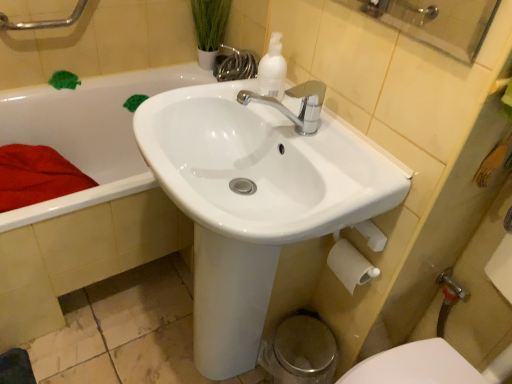
Image resolution: width=512 pixels, height=384 pixels. I want to click on white glossy bathtub at upper left, so click(x=88, y=134).

What do you see at coordinates (254, 199) in the screenshot? This screenshot has width=512, height=384. I see `white glossy sink at center` at bounding box center [254, 199].

Locate an element on the screen. Image resolution: width=512 pixels, height=384 pixels. white matte pump bottle at upper center is located at coordinates (272, 70).

The image size is (512, 384). What do you see at coordinates (451, 288) in the screenshot? I see `metallic silver faucet at lower right` at bounding box center [451, 288].

Describe the element at coordinates (210, 22) in the screenshot. The image size is (512, 384). I see `green leafy plant at upper center` at that location.

Find the location of a particular element. green leafy plant at upper center is located at coordinates (210, 22).

Image resolution: width=512 pixels, height=384 pixels. I want to click on white glossy bathtub at upper left, so click(88, 134).

Is metallic silver faucet at lower right to the left or to the right of brushed metal grab bar at upper left in the image?

From the image, it's evident that metallic silver faucet at lower right is to the right of brushed metal grab bar at upper left.

From the picture: Is metallic silver faucet at lower right wider than brushed metal grab bar at upper left?

No, metallic silver faucet at lower right is not wider than brushed metal grab bar at upper left.

From a real-world perspective, does metallic silver faucet at lower right stand above brushed metal grab bar at upper left?

No, from a real-world perspective, metallic silver faucet at lower right is not over brushed metal grab bar at upper left

Is metallic silver faucet at lower right far from brushed metal grab bar at upper left?

Yes, metallic silver faucet at lower right and brushed metal grab bar at upper left are quite far apart.

Which is in front, point (312, 97) or point (60, 212)?

The point (312, 97) is closer.

Is polished chrome faucet at center in front of or behind white glossy bathtub at upper left in the image?

polished chrome faucet at center is in front of white glossy bathtub at upper left.

Is polished chrome faucet at center shorter than white glossy bathtub at upper left?

Yes.

From the image's perspective, which one is positioned lower, polished chrome faucet at center or white glossy bathtub at upper left?

white glossy bathtub at upper left is shown below in the image.

Is metallic silver faucet at lower right far from green leafy plant at upper center?

metallic silver faucet at lower right is far away from green leafy plant at upper center.

From a real-world perspective, which is physically above, metallic silver faucet at lower right or green leafy plant at upper center?

green leafy plant at upper center is physically above.

At what (x,y) coordinates should I click in order to perform the action: click on plant above the metallic silver faucet at lower right (from a real-world perspective). Please return your answer as a coordinate pair (x, y). The height and width of the screenshot is (384, 512). Looking at the image, I should click on (210, 22).

You are a GUI agent. You are given a task and a screenshot of the screen. Output one action in this format:
    pyautogui.click(x=<x>, y=<y>)
    Task: Click on the plant that appears above the white glossy bathtub at upper left (from a real-world perspective)
    The image size is (512, 384).
    Given the screenshot: What is the action you would take?
    pyautogui.click(x=210, y=22)

Considering the sizes of green leafy plant at upper center and white glossy bathtub at upper left in the image, is green leafy plant at upper center taller or shorter than white glossy bathtub at upper left?

green leafy plant at upper center is shorter than white glossy bathtub at upper left.

Is green leafy plant at upper center facing towards white glossy bathtub at upper left?

No, green leafy plant at upper center is not facing towards white glossy bathtub at upper left.

Considering the relative sizes of green leafy plant at upper center and white glossy bathtub at upper left in the image provided, is green leafy plant at upper center thinner than white glossy bathtub at upper left?

Indeed, green leafy plant at upper center has a lesser width compared to white glossy bathtub at upper left.

Is polished chrome faucet at center placed right next to white matte toilet paper at lower right?

There is a gap between polished chrome faucet at center and white matte toilet paper at lower right.

From a real-world perspective, is polished chrome faucet at center positioned above or below white matte toilet paper at lower right?

polished chrome faucet at center is situated higher than white matte toilet paper at lower right in the real world.

Which is closer, [317,127] or [365,265]?

Point [317,127].

Looking at this image, from the image's perspective, which is above, polished chrome faucet at center or brushed metal grab bar at upper left?

brushed metal grab bar at upper left appears higher in the image.

Is polished chrome faucet at center positioned with its back to brushed metal grab bar at upper left?

No.

Is polished chrome faucet at center inside or outside of brushed metal grab bar at upper left?

polished chrome faucet at center is spatially situated outside brushed metal grab bar at upper left.

Between white matte toilet paper at lower right and polished chrome faucet at center, which one appears on the right side from the viewer's perspective?

Positioned to the right is white matte toilet paper at lower right.

Considering the points (343, 259) and (302, 103), which point is behind, point (343, 259) or point (302, 103)?

Positioned behind is point (343, 259).

From a real-world perspective, is white matte toilet paper at lower right located higher than polished chrome faucet at center?

Incorrect, from a real-world perspective, white matte toilet paper at lower right is lower than polished chrome faucet at center.

How far apart are white matte toilet paper at lower right and polished chrome faucet at center?

white matte toilet paper at lower right and polished chrome faucet at center are 13.08 inches apart.

What are the coordinates of `plumbing fixture below the brushed metal grab bar at upper left (from the image's perspective)` in the screenshot? It's located at (451, 288).

Locate an element on the screen. Image resolution: width=512 pixels, height=384 pixels. tap that is in front of the white glossy bathtub at upper left is located at coordinates (301, 104).

In the scene shown: Which object lies nearer to the anchor point brushed metal grab bar at upper left, white glossy bathtub at upper left or white glossy sink at center?

Based on the image, white glossy bathtub at upper left appears to be nearer to brushed metal grab bar at upper left.

When comparing their distances from white glossy bathtub at upper left, does brushed metal grab bar at upper left or metallic silver faucet at lower right seem further?

metallic silver faucet at lower right lies further to white glossy bathtub at upper left than the other object.

Estimate the real-world distances between objects in this image. Which object is further from brushed metal grab bar at upper left, polished chrome faucet at center or green leafy plant at upper center?

polished chrome faucet at center is further to brushed metal grab bar at upper left.

From the image, which object appears to be farther from green leafy plant at upper center, white matte toilet paper at lower right or white glossy sink at center?

The object further to green leafy plant at upper center is white matte toilet paper at lower right.

From the image, which object appears to be farther from metallic silver faucet at lower right, white matte pump bottle at upper center or green leafy plant at upper center?

green leafy plant at upper center lies further to metallic silver faucet at lower right than the other object.

Based on their spatial positions, is metallic silver faucet at lower right or white glossy bathtub at upper left closer to green leafy plant at upper center?

white glossy bathtub at upper left.

Based on their spatial positions, is white glossy sink at center or green leafy plant at upper center closer to white matte pump bottle at upper center?

white glossy sink at center lies closer to white matte pump bottle at upper center than the other object.

Considering their positions, is polished chrome faucet at center positioned closer to white glossy sink at center than white matte toilet paper at lower right?

Based on the image, polished chrome faucet at center appears to be nearer to white glossy sink at center.

You are a GUI agent. You are given a task and a screenshot of the screen. Output one action in this format:
    pyautogui.click(x=<x>, y=<y>)
    Task: Click on the plant between brushed metal grab bar at upper left and polished chrome faucet at center
    This screenshot has height=384, width=512.
    Given the screenshot: What is the action you would take?
    pyautogui.click(x=210, y=22)

This screenshot has height=384, width=512. I want to click on cleaning product between white glossy bathtub at upper left and metallic silver faucet at lower right from left to right, so click(272, 70).

What are the coordinates of `tap between white matte pump bottle at upper center and white glossy sink at center vertically` in the screenshot? It's located at (301, 104).

Find the location of a particular element. The image size is (512, 384). cleaning product between brushed metal grab bar at upper left and polished chrome faucet at center from left to right is located at coordinates (272, 70).